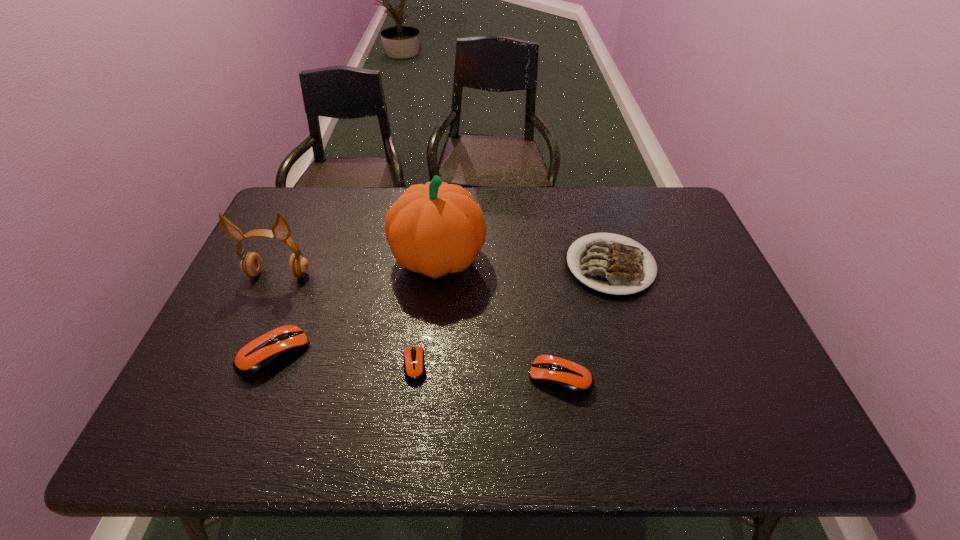
In the current image, all computer mouses are evenly spaced. To maintain this equal spacing, where should an additional computer mouse be placed on the right? Please point out a free spot. Please provide its 2D coordinates. Your answer should be formatted as a tuple, i.e. [(x, y)], where the tuple contains the x and y coordinates of a point satisfying the conditions above.

[(712, 390)]